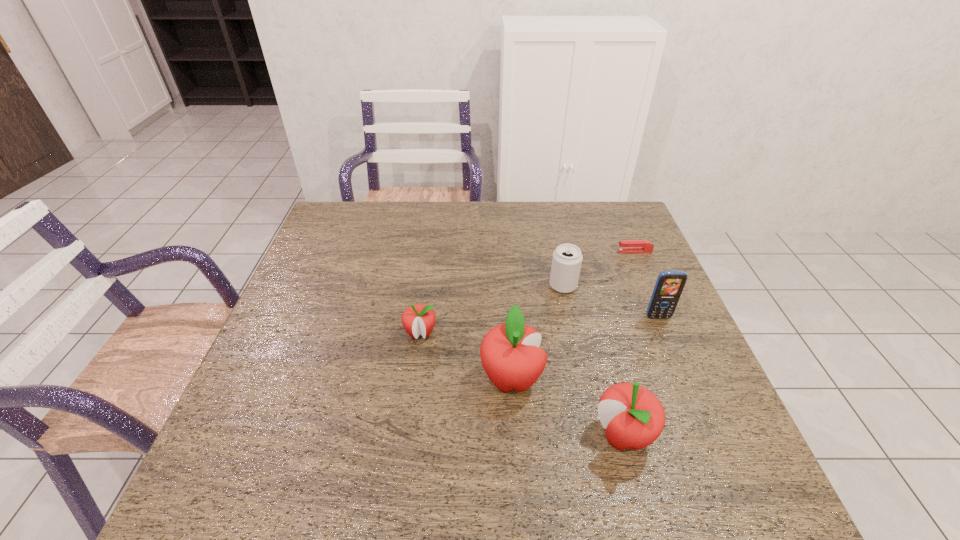
This screenshot has height=540, width=960. In order to click on cellular telephone in this screenshot , I will do `click(669, 285)`.

Where is `vacant space situated on the right of the leftmost apple`? Image resolution: width=960 pixels, height=540 pixels. vacant space situated on the right of the leftmost apple is located at coordinates (529, 333).

This screenshot has height=540, width=960. Identify the location of free space located 0.130m on the back of the fifth object from right to left. (507, 315).

Where is `vacant region located 0.260m on the left of the second tallest apple`? The height and width of the screenshot is (540, 960). vacant region located 0.260m on the left of the second tallest apple is located at coordinates (465, 435).

Image resolution: width=960 pixels, height=540 pixels. Identify the location of free space located 0.220m on the right of the can. (656, 286).

The image size is (960, 540). I want to click on vacant position located 0.210m on the front-facing side of the shortest object, so click(549, 251).

Image resolution: width=960 pixels, height=540 pixels. Identify the location of free space located on the front-facing side of the shortest object. (598, 251).

Find the location of a particular element. The width and height of the screenshot is (960, 540). vacant area situated 0.220m on the front-facing side of the shortest object is located at coordinates (545, 251).

Where is `vacant space situated 0.240m on the screen of the cellular telephone`? This screenshot has height=540, width=960. vacant space situated 0.240m on the screen of the cellular telephone is located at coordinates (693, 402).

Where is `object that is at the near edge`? This screenshot has width=960, height=540. object that is at the near edge is located at coordinates (633, 417).